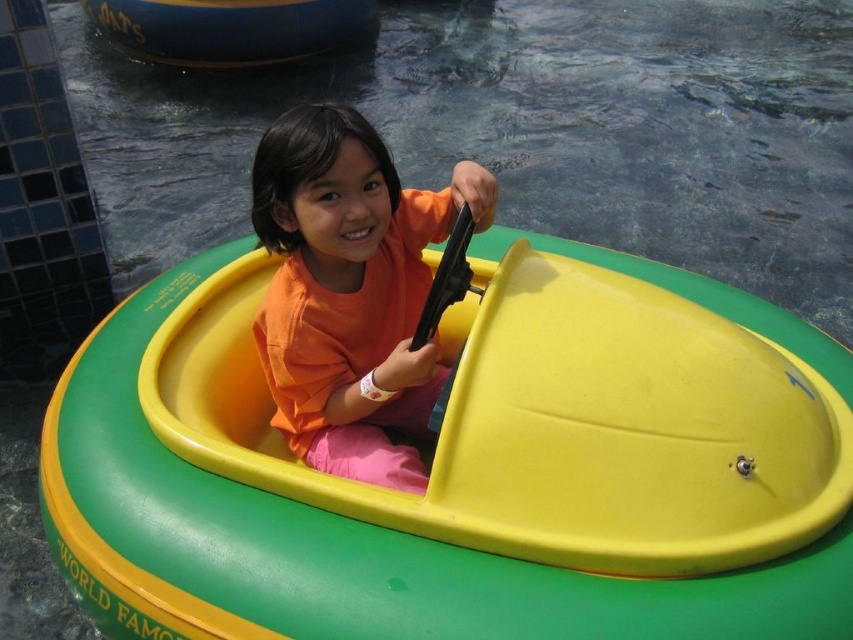
You are a lifeguard standing at the edge of the pool. You see the yellow matte plastic boat at center and the orange matte shirt at center. Which object is closer to the water surface?

The yellow matte plastic boat at center is positioned under the orange matte shirt at center, so the boat is closer to the water surface than the shirt.

You are planning to bring a 2.5 meters wide inflatable raft to the pool. You see the yellow matte plastic boat at center and the blue rubber boat at upper left in the image. Which boat has a smaller width that might not accommodate your raft?

The yellow matte plastic boat at center has a lesser width compared to the blue rubber boat at upper left, so it might not accommodate your 2.5 meters wide inflatable raft.

You are a lifeguard standing at the edge of the pool. You see the yellow matte plastic boat at center and the orange matte shirt at center. If the safety protocol requires that the distance between any swimmer and their boat must be less than 20 inches for quick retrieval, is the current distance compliant?

The distance between the yellow matte plastic boat at center and the orange matte shirt at center is 20.15 inches, which exceeds the 20 inches requirement. Therefore, the current distance is not compliant with the safety protocol.